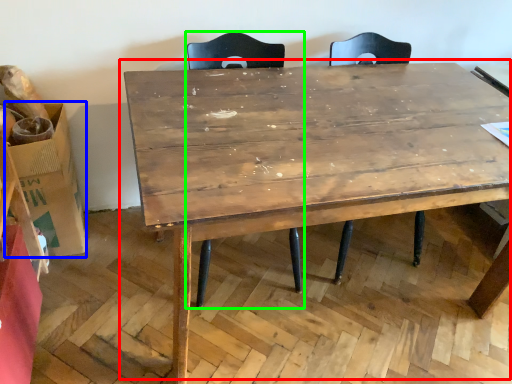
Question: Which is nearer to the table (highlighted by a red box)? cardboard box (highlighted by a blue box) or swivel chair (highlighted by a green box).

Choices:
 (A) cardboard box
 (B) swivel chair

Answer: (B)